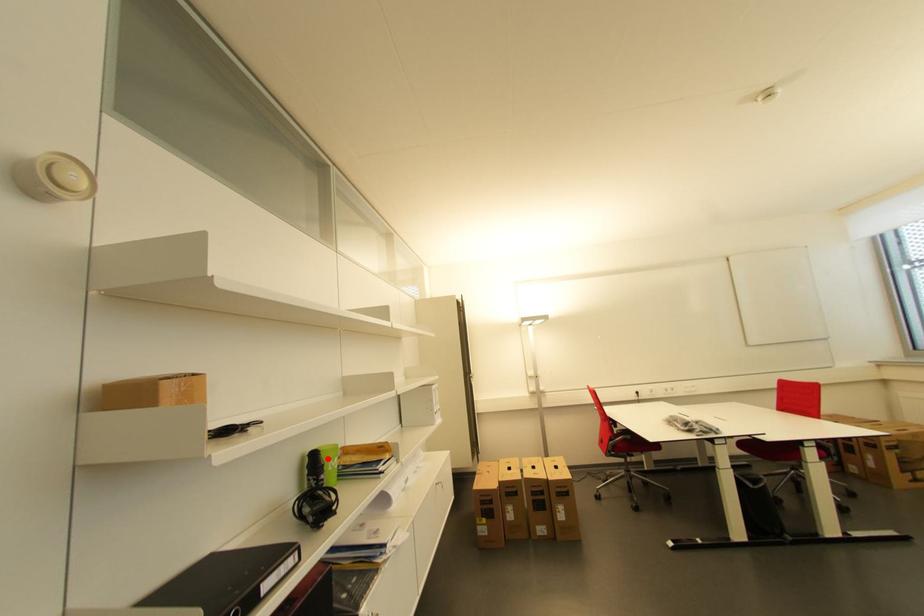
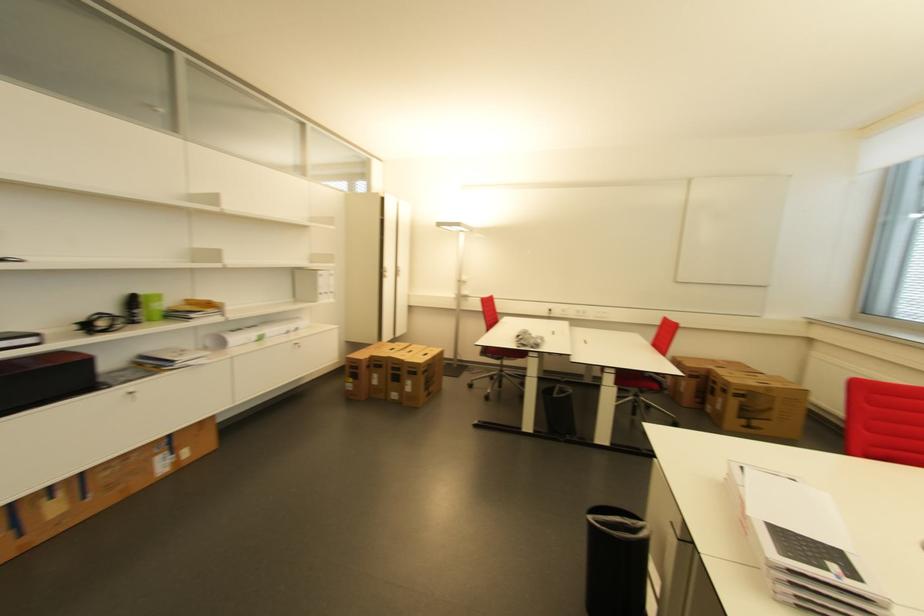
Find the pixel in the second image that matches the highlighted location in the first image.

(147, 301)